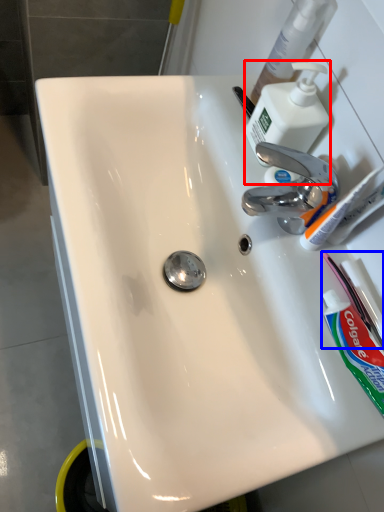
Question: Among these objects, which one is farthest to the camera, soap dispenser (highlighted by a red box) or toothbrush (highlighted by a blue box)?

Choices:
 (A) soap dispenser
 (B) toothbrush

Answer: (A)